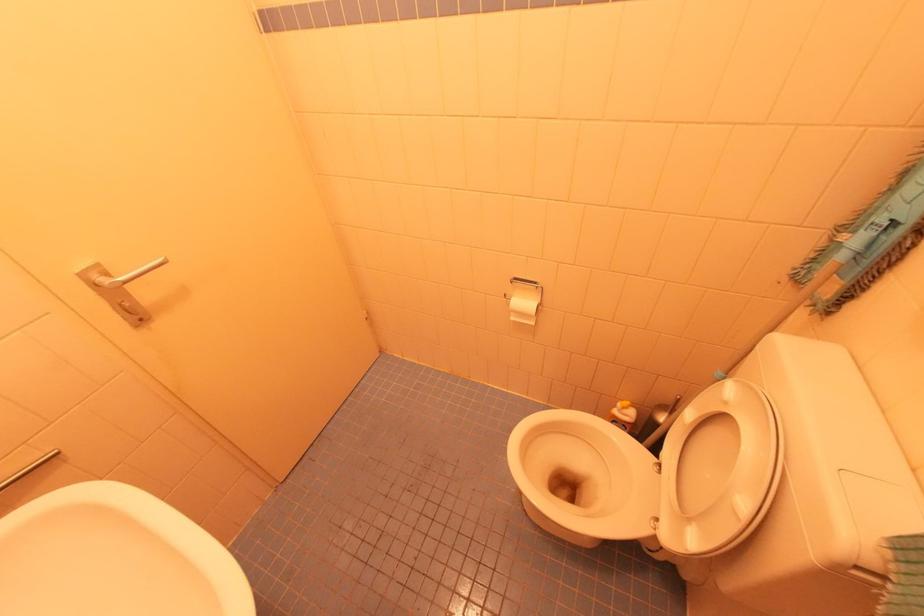
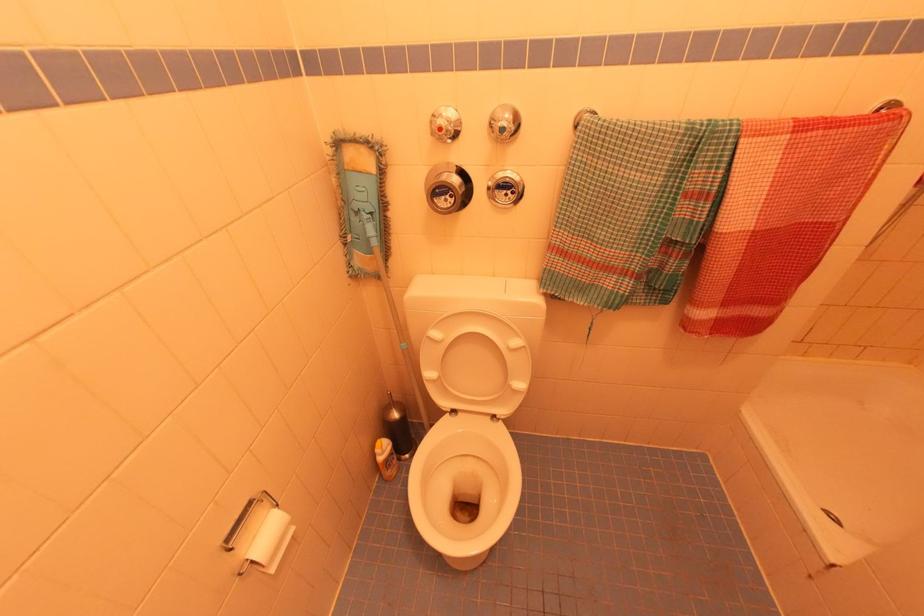
The point at (626, 411) is marked in the first image. Where is the corresponding point in the second image?

(385, 448)